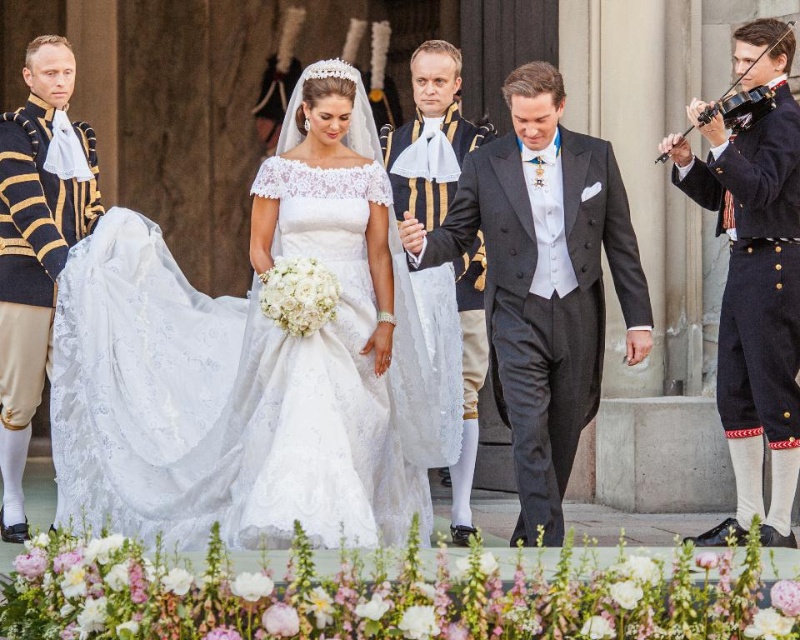
Measure the distance between point (736, 369) and camera.

They are 208.34 feet apart.

Is point (748, 307) closer to camera compared to point (458, 541)?

Yes, it is in front of point (458, 541).

This screenshot has height=640, width=800. I want to click on dark blue uniform at right, so click(754, 278).

Between point (254, 506) and point (424, 56), which one is positioned in front?

Point (254, 506)

Identify the location of white lace dress at center. (244, 390).

Which is behind, point (297, 493) or point (786, 252)?

The point (786, 252) is behind.

Is lace fabric dress at center shorter than dark blue uniform at right?

Yes.

Does point (336, 198) come behind point (760, 456)?

No, (336, 198) is in front of (760, 456).

The image size is (800, 640). What are the coordinates of `lace fabric dress at center` in the screenshot? It's located at (329, 374).